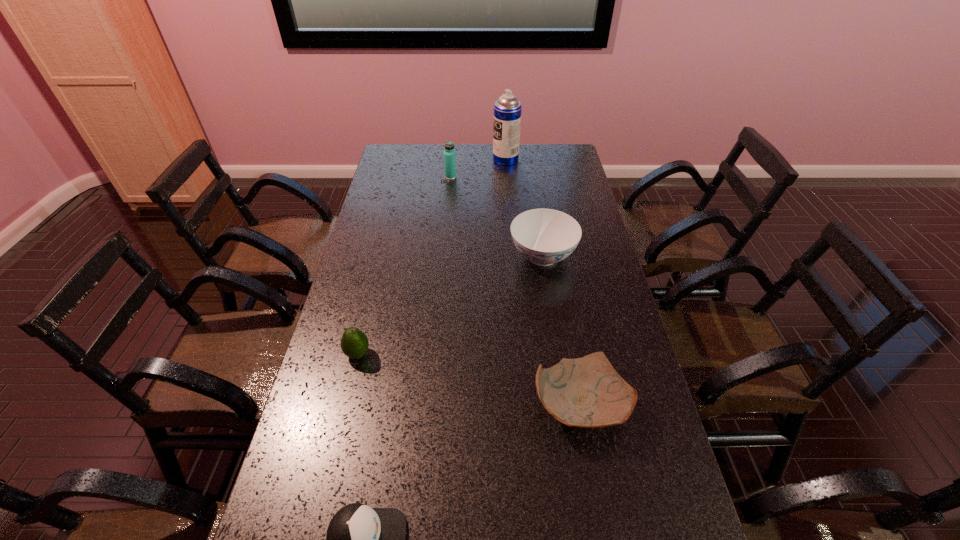
This screenshot has height=540, width=960. Find the location of `vacant area located on the right of the second farthest object`. vacant area located on the right of the second farthest object is located at coordinates (535, 177).

Locate an element on the screen. free space located 0.280m on the back of the third farthest object is located at coordinates (533, 193).

Image resolution: width=960 pixels, height=540 pixels. What are the coordinates of `free space located on the right of the avocado` in the screenshot? It's located at (470, 354).

Find the location of `free spot located 0.200m on the front of the fifth farthest object`. free spot located 0.200m on the front of the fifth farthest object is located at coordinates (604, 536).

Find the location of `object that is at the far edge`. object that is at the far edge is located at coordinates (507, 110).

You are a GUI agent. You are given a task and a screenshot of the screen. Output one action in this format:
    pyautogui.click(x=<x>, y=<y>)
    Task: Click on the object that is at the left edge
    This screenshot has height=540, width=960.
    Given the screenshot: What is the action you would take?
    pyautogui.click(x=354, y=343)

Where is `chinaware situated at the right edge`? This screenshot has height=540, width=960. chinaware situated at the right edge is located at coordinates (544, 236).

At what (x,y) coordinates should I click in order to perform the action: click on pottery positioned at the right edge. Please return your answer as a coordinate pair (x, y). The width and height of the screenshot is (960, 540). Looking at the image, I should click on (587, 392).

The image size is (960, 540). I want to click on vacant space at the left edge, so click(325, 369).

The image size is (960, 540). Identify the location of free space at the right edge of the desktop. (557, 183).